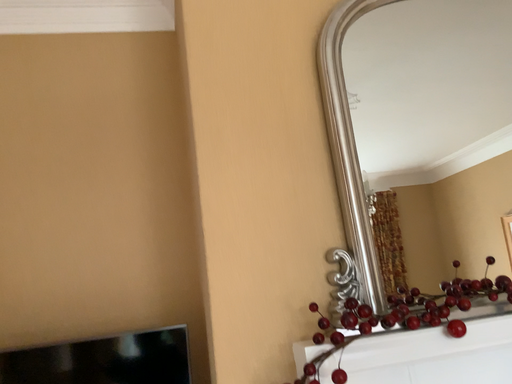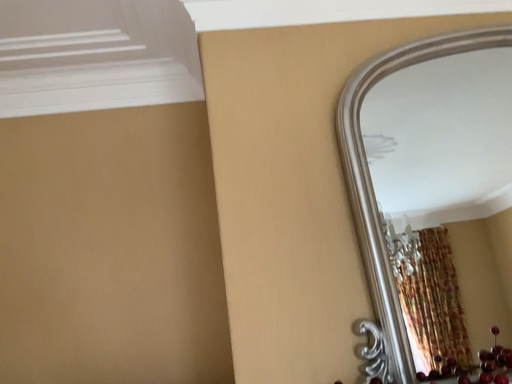
Question: How did the camera likely rotate when shooting the video?

Choices:
 (A) rotated right
 (B) rotated left

Answer: (B)